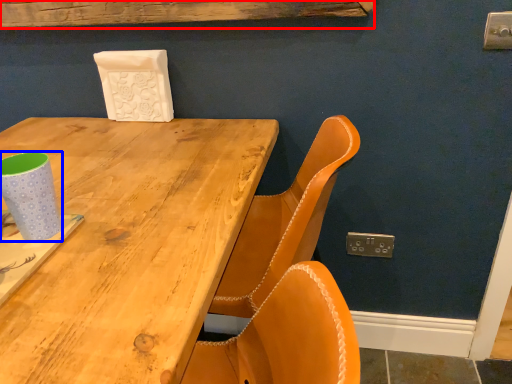
Question: Which object appears farthest to the camera in this image, plank (highlighted by a red box) or paper cup (highlighted by a blue box)?

Choices:
 (A) plank
 (B) paper cup

Answer: (A)